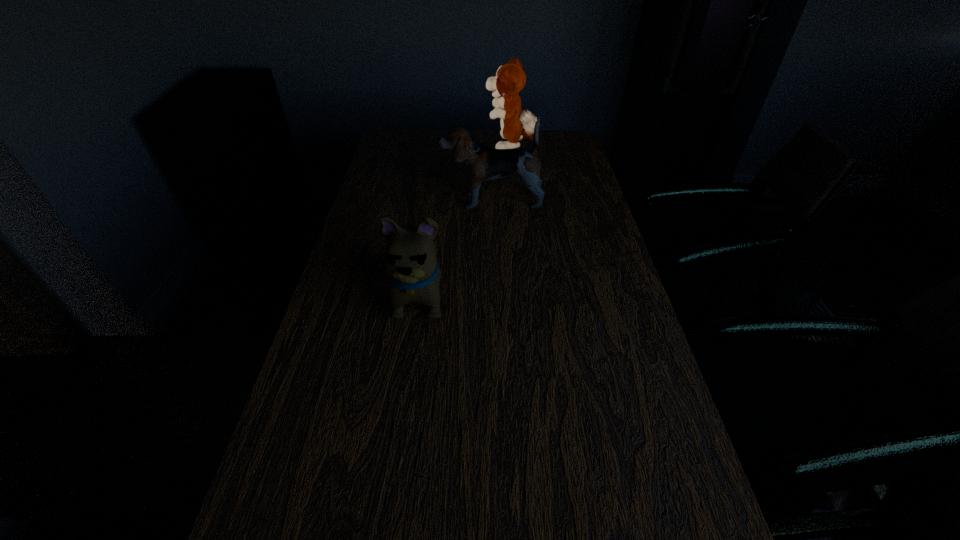
The height and width of the screenshot is (540, 960). I want to click on the farthest puppy, so click(x=510, y=79).

Locate an element on the screen. The image size is (960, 540). the second farthest object is located at coordinates (482, 163).

In order to click on the nearest puppy in this screenshot , I will do `click(410, 263)`.

Identify the location of vacant space situated on the face of the farthest object. The image size is (960, 540). (385, 147).

The image size is (960, 540). In order to click on free space located on the face of the farthest object in this screenshot , I will do `click(458, 147)`.

Image resolution: width=960 pixels, height=540 pixels. Identify the location of free space located on the face of the farthest object. (415, 147).

You are a GUI agent. You are given a task and a screenshot of the screen. Output one action in this format:
    pyautogui.click(x=<x>, y=<y>)
    Task: Click on the vacant space situated 0.060m at the face of the second farthest object
    
    Given the screenshot: What is the action you would take?
    pyautogui.click(x=423, y=201)

At what (x,y) coordinates should I click in order to perform the action: click on free spot located 0.240m at the face of the second farthest object. Please return your answer as a coordinate pair (x, y). The height and width of the screenshot is (540, 960). Looking at the image, I should click on (369, 201).

Identify the location of free space located at the face of the second farthest object. (x=426, y=201).

In order to click on free location located on the face of the nearest puppy in this screenshot , I will do `click(397, 456)`.